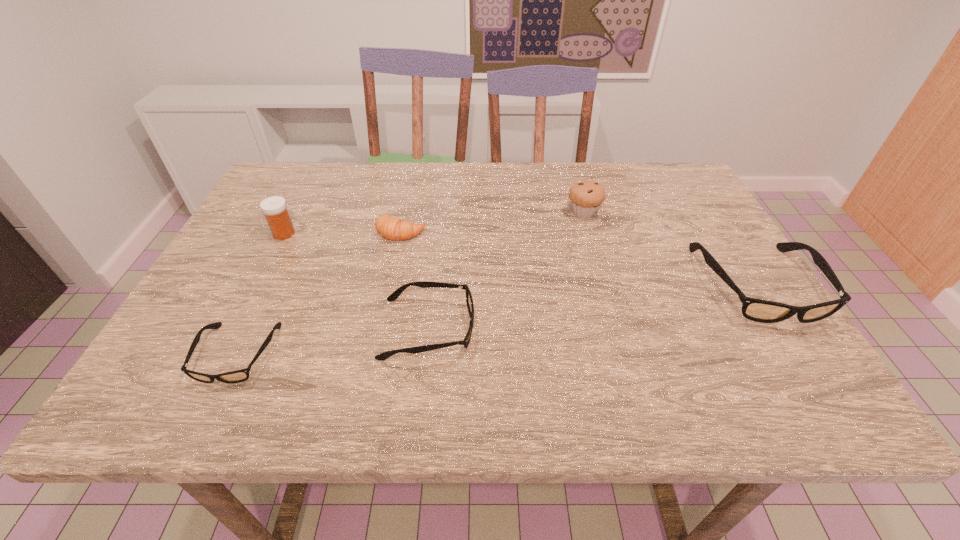
You are a GUI agent. You are given a task and a screenshot of the screen. Output one action in this format:
    pyautogui.click(x=<x>, y=<y>)
    Task: Click on the shortest object
    This screenshot has width=960, height=540.
    Given the screenshot: What is the action you would take?
    click(237, 376)

Where is `the leftmost spectacles`? the leftmost spectacles is located at coordinates (237, 376).

Where is `the second shortest spectacles`? The height and width of the screenshot is (540, 960). the second shortest spectacles is located at coordinates (423, 284).

At what (x,y) coordinates should I click in order to perform the action: click on the third tallest object. Please return your answer as a coordinate pair (x, y). The image size is (960, 540). Looking at the image, I should click on (758, 310).

Locate an element on the screen. This screenshot has height=540, width=960. the tallest spectacles is located at coordinates (758, 310).

This screenshot has width=960, height=540. Find the location of `medicine`. medicine is located at coordinates (274, 208).

Locate an element on the screen. The image size is (960, 540). crescent roll is located at coordinates (392, 228).

I want to click on the fifth object from left to right, so click(586, 196).

Where is `vacant space located on the front-facing side of the second tallest spectacles`? vacant space located on the front-facing side of the second tallest spectacles is located at coordinates (622, 329).

At what (x,y) coordinates should I click in order to perform the action: click on free spot located 0.090m on the front-facing side of the rightmost object. Please return your answer as a coordinate pair (x, y). Looking at the image, I should click on (810, 368).